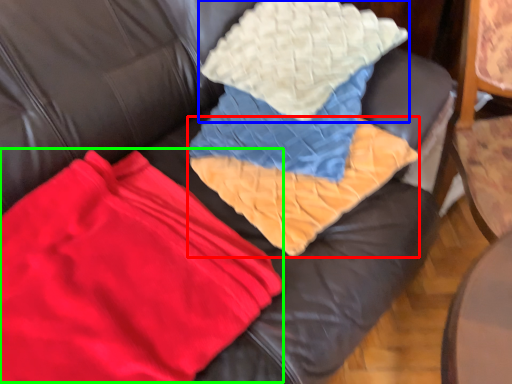
Question: Which is farther away from blanket (highlighted by a red box)? throw pillow (highlighted by a blue box) or fabric (highlighted by a green box)?

Choices:
 (A) throw pillow
 (B) fabric

Answer: (B)